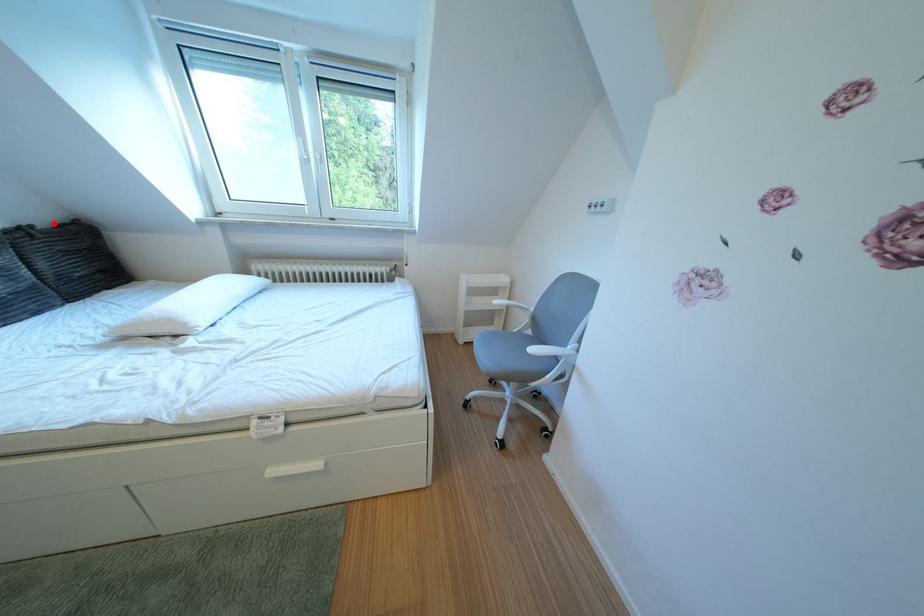
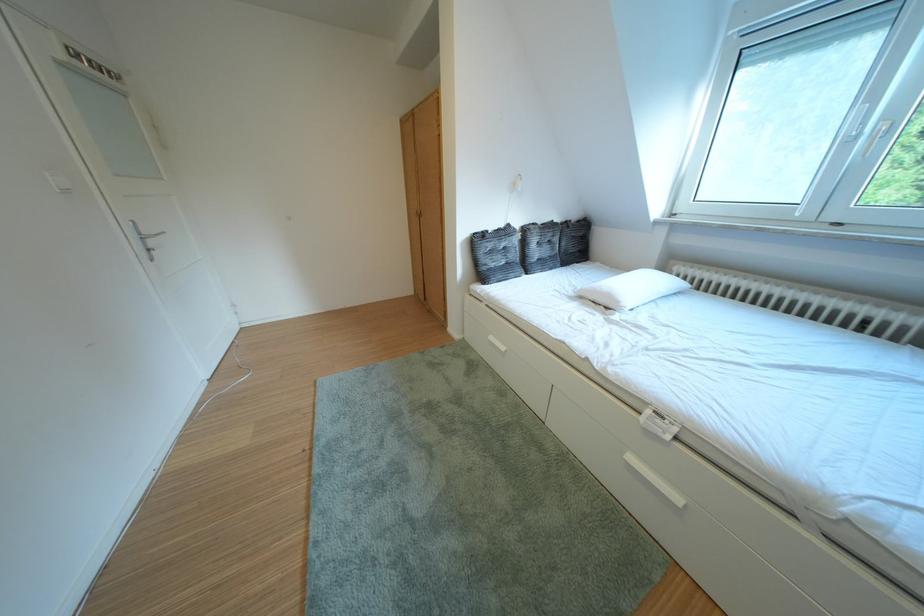
The point at the highlighted location is marked in the first image. Where is the corresponding point in the second image?

(588, 222)